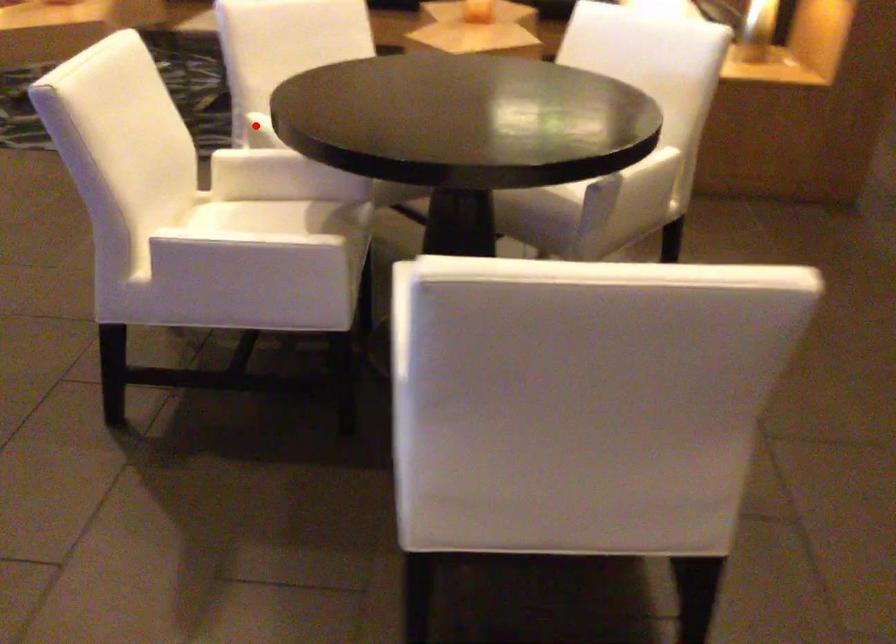
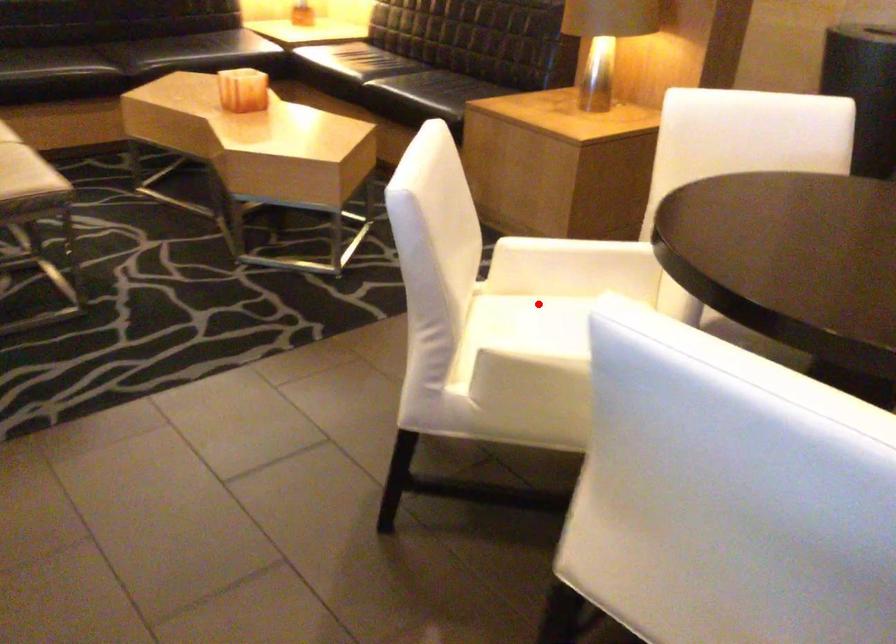
I am providing you with two images of the same scene from different viewpoints. A red point is marked on the first image and another point is marked on the second image. Does the point marked in image1 correspond to the same location as the one in image2?

No